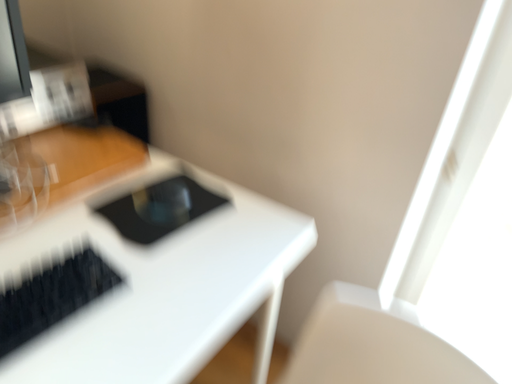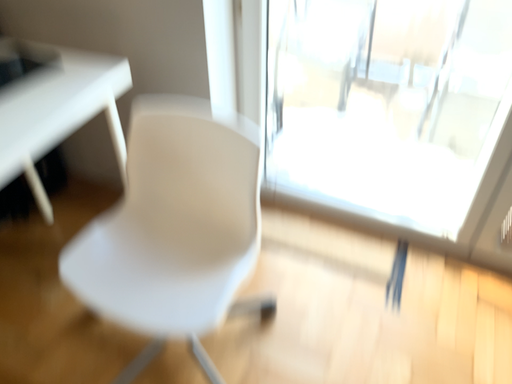
Question: How did the camera likely rotate when shooting the video?

Choices:
 (A) rotated right
 (B) rotated left

Answer: (A)